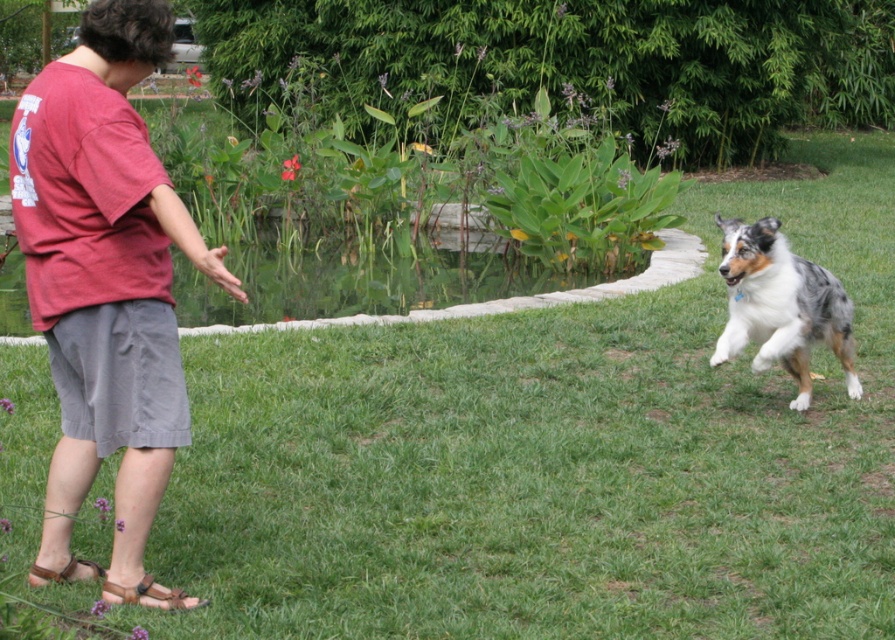
Question: Is red cotton t-shirt at left thinner than blue-gray fur dog at right?

Choices:
 (A) no
 (B) yes

Answer: (B)

Question: Which object appears farthest from the camera in this image?

Choices:
 (A) red cotton t-shirt at left
 (B) blue-gray fur dog at right

Answer: (B)

Question: Which object is farther from the camera taking this photo?

Choices:
 (A) blue-gray fur dog at right
 (B) red cotton t-shirt at left

Answer: (A)

Question: Observing the image, what is the correct spatial positioning of red cotton t-shirt at left in reference to blue-gray fur dog at right?

Choices:
 (A) below
 (B) above

Answer: (B)

Question: Can you confirm if red cotton t-shirt at left is positioned to the right of blue-gray fur dog at right?

Choices:
 (A) no
 (B) yes

Answer: (A)